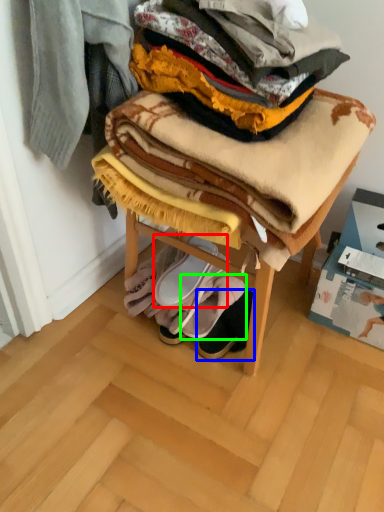
Question: Which object is the farthest from footwear (highlighted by a red box)? Choose among these: footwear (highlighted by a blue box) or footwear (highlighted by a green box).

Choices:
 (A) footwear
 (B) footwear

Answer: (A)